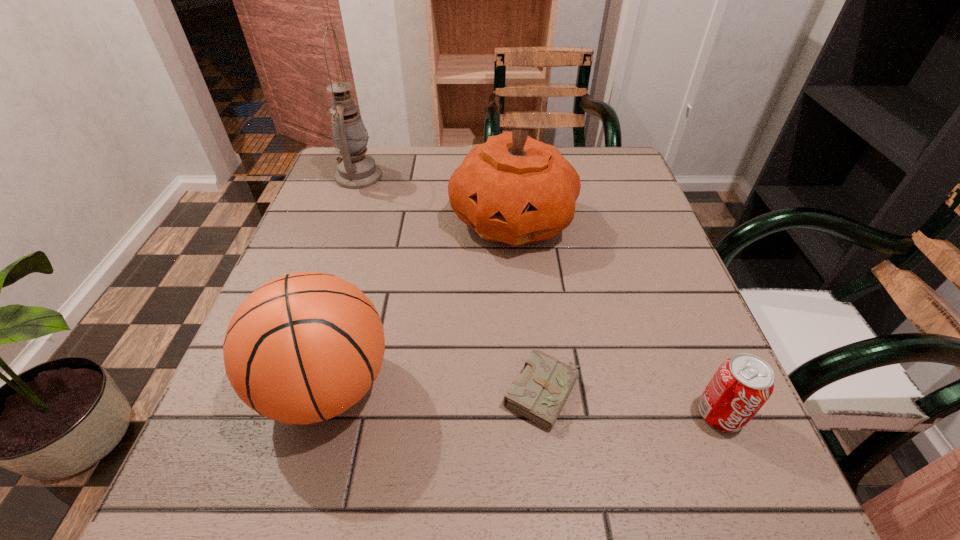
What are the coordinates of `blank space at the right edge of the desktop` in the screenshot? It's located at (707, 349).

Identify the location of free space at the far right corner. Image resolution: width=960 pixels, height=540 pixels. (616, 182).

In the image, there is a desktop. Identify the location of vacant space at the near right corner. click(x=713, y=481).

Find the location of a particular element. free space that is in between the shortest object and the oil lamp is located at coordinates (451, 285).

Identify the location of free spot between the diary and the rightmost object. The width and height of the screenshot is (960, 540). (632, 403).

This screenshot has height=540, width=960. I want to click on empty location between the soda and the tallest object, so click(x=540, y=295).

Identify the location of empty space between the diary and the soda. (632, 403).

Locate an element on the screen. Image resolution: width=960 pixels, height=540 pixels. empty space that is in between the diary and the basketball is located at coordinates (435, 390).

Identify the location of free space between the soda and the diary. (632, 403).

The height and width of the screenshot is (540, 960). Find the location of `the fourth closest object to the shortest object`. the fourth closest object to the shortest object is located at coordinates click(x=356, y=170).